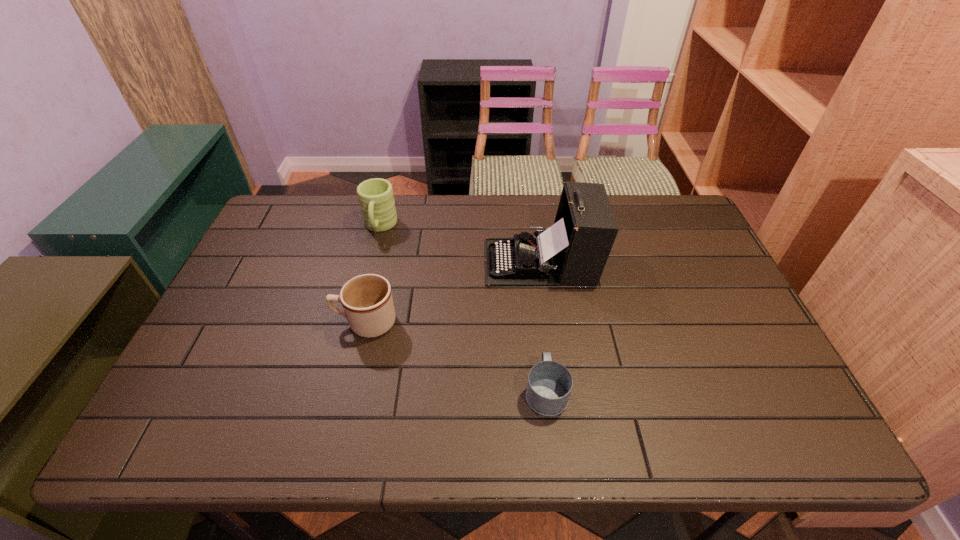
Where is `free space at the right edge of the desktop`? free space at the right edge of the desktop is located at coordinates (672, 263).

Locate an element on the screen. This screenshot has height=540, width=960. vacant space at the far right corner of the desktop is located at coordinates (648, 218).

In order to click on blank region between the farthest mug and the tallest object in this screenshot , I will do `click(460, 245)`.

Find the location of a particular element. empty space between the rightmost mug and the farthest mug is located at coordinates (463, 309).

Locate an element on the screen. Image resolution: width=960 pixels, height=540 pixels. free space between the nearest object and the farthest mug is located at coordinates (463, 309).

The height and width of the screenshot is (540, 960). I want to click on free space that is in between the typewriter and the farthest mug, so click(460, 245).

At what (x,y) coordinates should I click in order to perform the action: click on vacant point located between the second nearest object and the nearest mug. Please return your answer as a coordinate pair (x, y). Image resolution: width=960 pixels, height=540 pixels. Looking at the image, I should click on (456, 357).

Where is `free space between the typewriter and the farthest mug`? The image size is (960, 540). free space between the typewriter and the farthest mug is located at coordinates (460, 245).

Identify the location of the closest object to the tallest object. This screenshot has width=960, height=540. (x=367, y=302).

Locate which object ranks third in proximity to the tallest object. Please provide its 2D coordinates. Your answer should be formatted as a tuple, i.e. [(x, y)], where the tuple contains the x and y coordinates of a point satisfying the conditions above.

[(376, 199)]